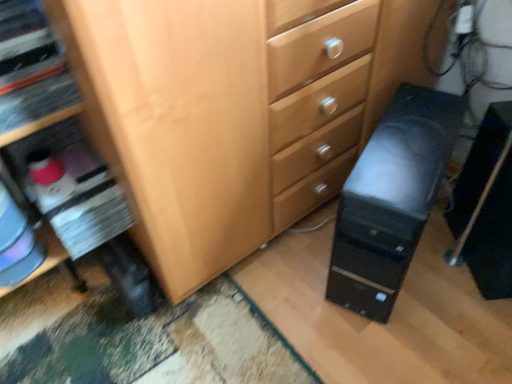
Question: From a real-world perspective, is black plastic computer tower at lower right, the 2th computer tower positioned from the left, above or below black plastic computer tower at lower right, the second computer tower from the right?

Choices:
 (A) above
 (B) below

Answer: (B)

Question: From the image's perspective, is black plastic computer tower at lower right, the 2th computer tower positioned from the left, positioned above or below black plastic computer tower at lower right, the second computer tower from the right?

Choices:
 (A) above
 (B) below

Answer: (B)

Question: Considering the positions of black plastic computer tower at lower right, arranged as the 1th computer tower when viewed from the right, and black plastic computer tower at lower right, the second computer tower from the right, in the image, is black plastic computer tower at lower right, arranged as the 1th computer tower when viewed from the right, bigger or smaller than black plastic computer tower at lower right, the second computer tower from the right,?

Choices:
 (A) small
 (B) big

Answer: (A)

Question: From their relative heights in the image, would you say black plastic computer tower at lower right, the second computer tower from the right, is taller or shorter than black plastic computer tower at lower right, arranged as the 1th computer tower when viewed from the right?

Choices:
 (A) short
 (B) tall

Answer: (B)

Question: From a real-world perspective, is black plastic computer tower at lower right, the second computer tower from the right, physically located above or below black plastic computer tower at lower right, arranged as the 1th computer tower when viewed from the right?

Choices:
 (A) below
 (B) above

Answer: (B)

Question: Do you think black plastic computer tower at lower right, which is the first computer tower from left to right, is within black plastic computer tower at lower right, the 2th computer tower positioned from the left, or outside of it?

Choices:
 (A) inside
 (B) outside

Answer: (B)

Question: Considering the relative positions of black plastic computer tower at lower right, which is the first computer tower from left to right, and black plastic computer tower at lower right, the 2th computer tower positioned from the left, in the image provided, is black plastic computer tower at lower right, which is the first computer tower from left to right, to the left or to the right of black plastic computer tower at lower right, the 2th computer tower positioned from the left,?

Choices:
 (A) right
 (B) left

Answer: (B)